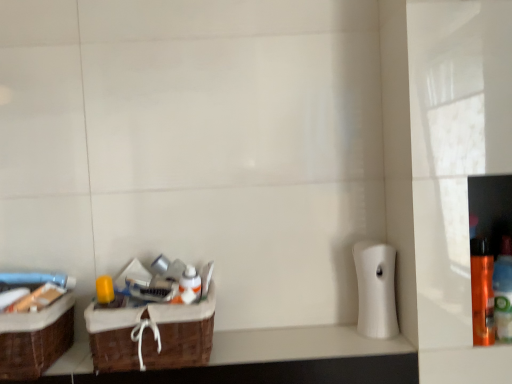
Identify the location of free spot above brown woven basket at lower left (from a real-world perspective). This screenshot has width=512, height=384. (290, 342).